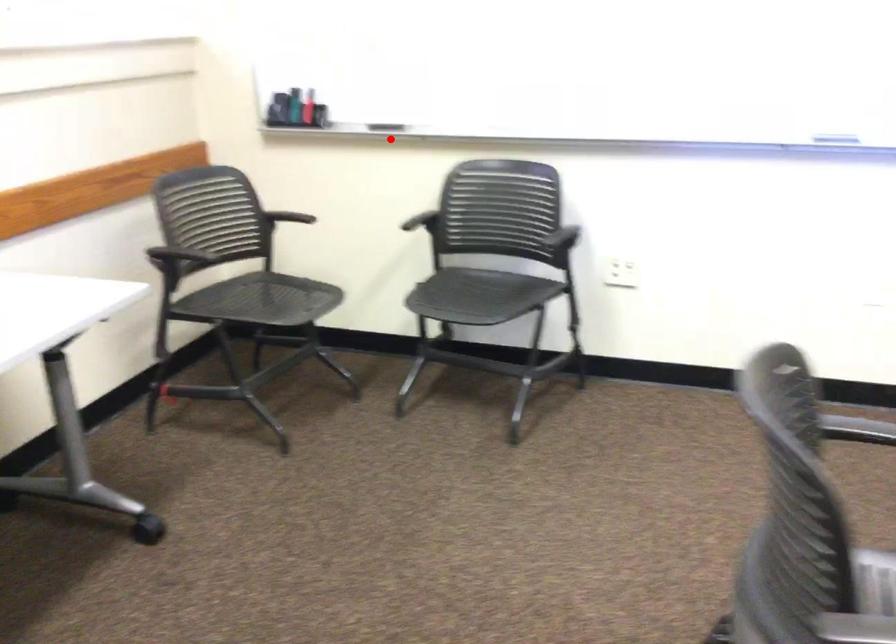
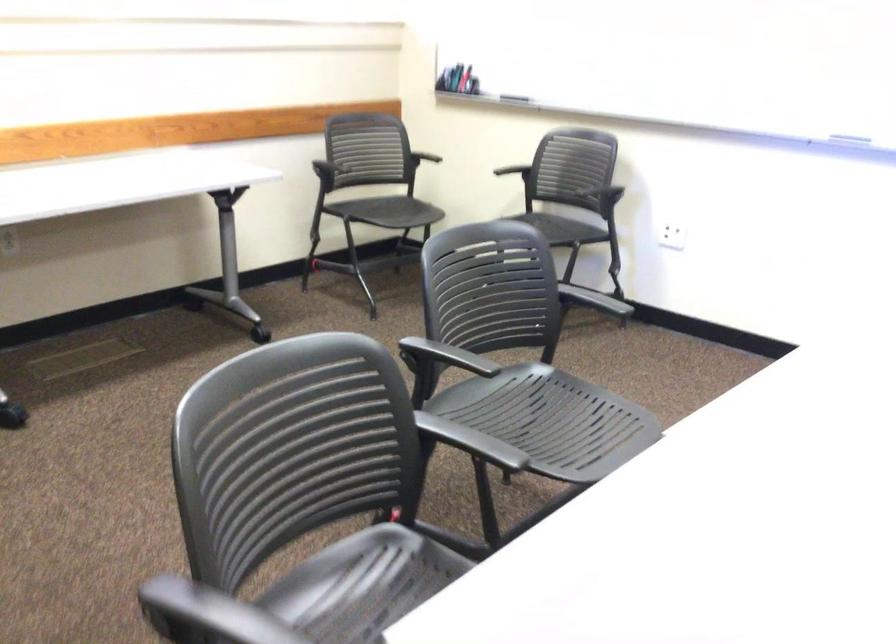
Question: I am providing you with two images of the same scene from different viewpoints. In image1, a red point is highlighted. Considering the same 3D point in image2, which of the following is correct?

Choices:
 (A) It is closer
 (B) It is farther

Answer: (B)